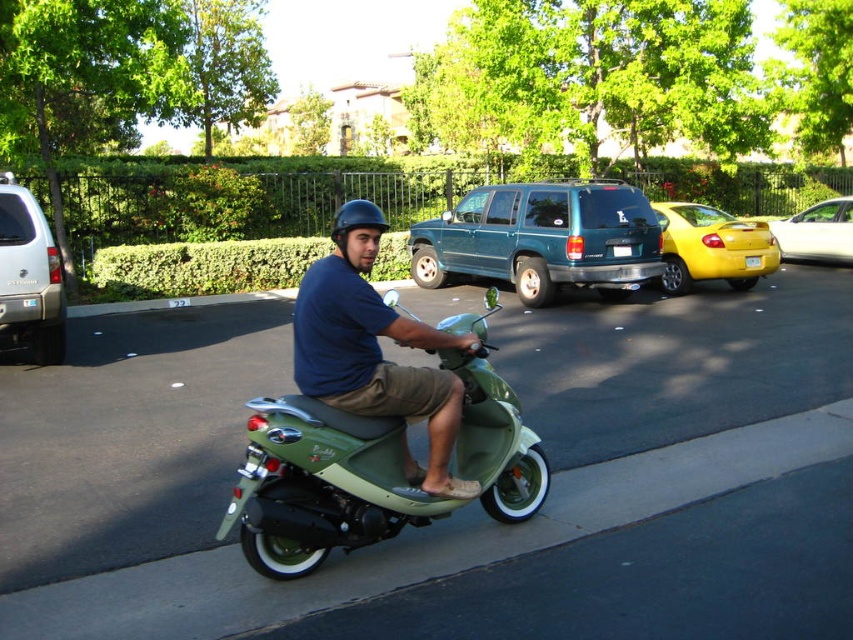
Is point (653, 220) more distant than point (448, 480)?

Yes, it is.

Is teal matte suv at center thinner than matte green scooter at center?

Incorrect, teal matte suv at center's width is not less than matte green scooter at center's.

Locate an element on the screen. teal matte suv at center is located at coordinates (543, 237).

Does green matte scooter at center appear on the left side of matte green scooter at center?

Incorrect, green matte scooter at center is not on the left side of matte green scooter at center.

Which is in front, point (248, 557) or point (344, 358)?

Point (248, 557) is more forward.

Which is in front, point (264, 538) or point (300, 346)?

Point (264, 538) is in front.

Image resolution: width=853 pixels, height=640 pixels. I want to click on green matte scooter at center, so click(320, 484).

Does point (543, 237) come behind point (628, 252)?

That is True.

Who is more forward, (605, 272) or (625, 256)?

Point (605, 272) is more forward.

Locate an element on the screen. teal matte suv at center is located at coordinates (543, 237).